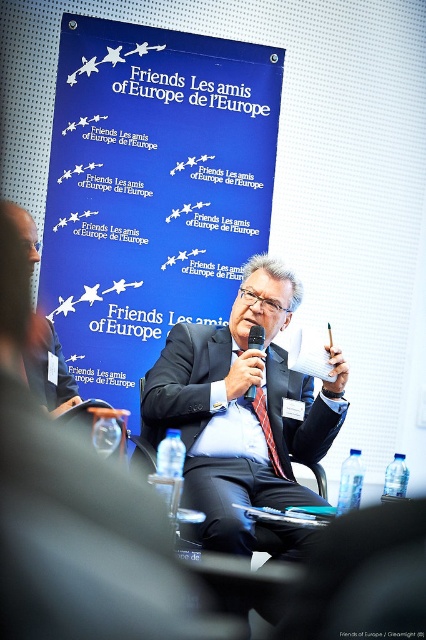
Question: Which point is farther from the camera taking this photo?

Choices:
 (A) (250, 340)
 (B) (264, 337)
 (C) (178, 227)
 (D) (146, 404)

Answer: (C)

Question: Among these points, which one is nearest to the camera?

Choices:
 (A) pos(294,440)
 (B) pos(253,387)

Answer: (B)

Question: Can you confirm if red silk tie at center is positioned below matte black microphone at center?

Choices:
 (A) yes
 (B) no

Answer: (A)

Question: Is red silk tie at center behind matte black microphone at center?

Choices:
 (A) yes
 (B) no

Answer: (A)

Question: Does dark blue fabric business suit at center come behind red silk tie at center?

Choices:
 (A) yes
 (B) no

Answer: (B)

Question: Which point appears farthest from the camera in this image?

Choices:
 (A) (291, 385)
 (B) (250, 392)

Answer: (A)